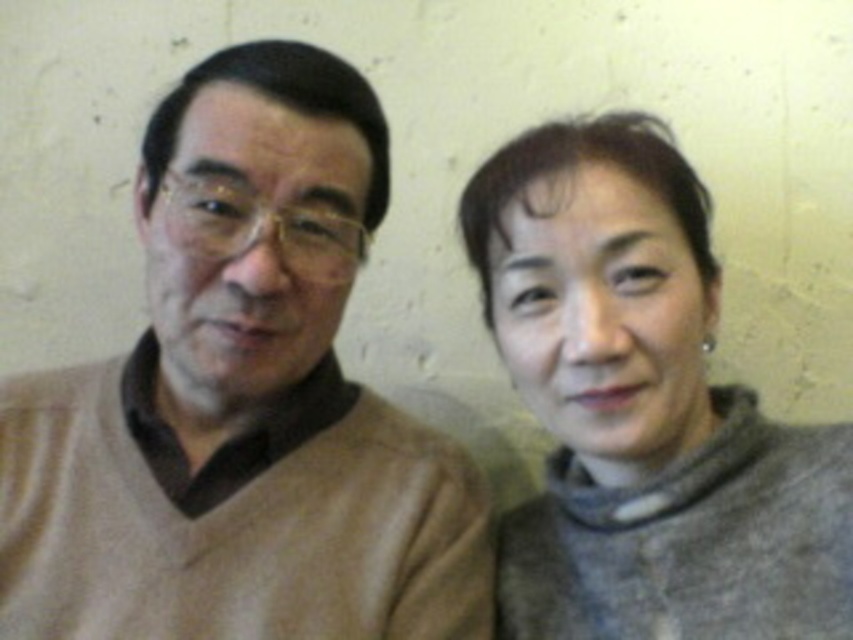
In the scene shown: Is beige sweater at left wider than gray woolen sweater at right?

Yes.

Locate an element on the screen. This screenshot has width=853, height=640. beige sweater at left is located at coordinates (241, 401).

This screenshot has width=853, height=640. I want to click on beige sweater at left, so 241,401.